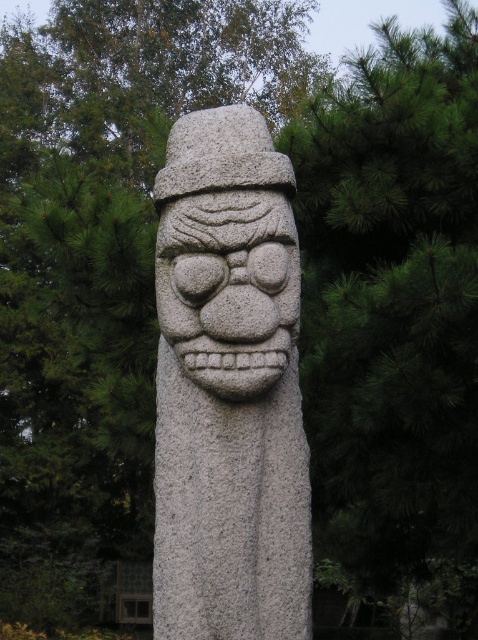
You are an art student analyzing the sculpture in the forest. You notice two parts of the statue labeled as the gray stone statue at center and the granite stone face at center. Which part of the sculpture is bigger?

The gray stone statue at center is larger in size than the granite stone face at center.

You are an artist planning to create a miniature version of the scene. You need to ensure the proportions between the gray stone statue at center and the granite stone face at center are accurate. Which object should you make taller in your model?

The gray stone statue at center should be made taller in the model since it has a greater height compared to the granite stone face at center according to the description.